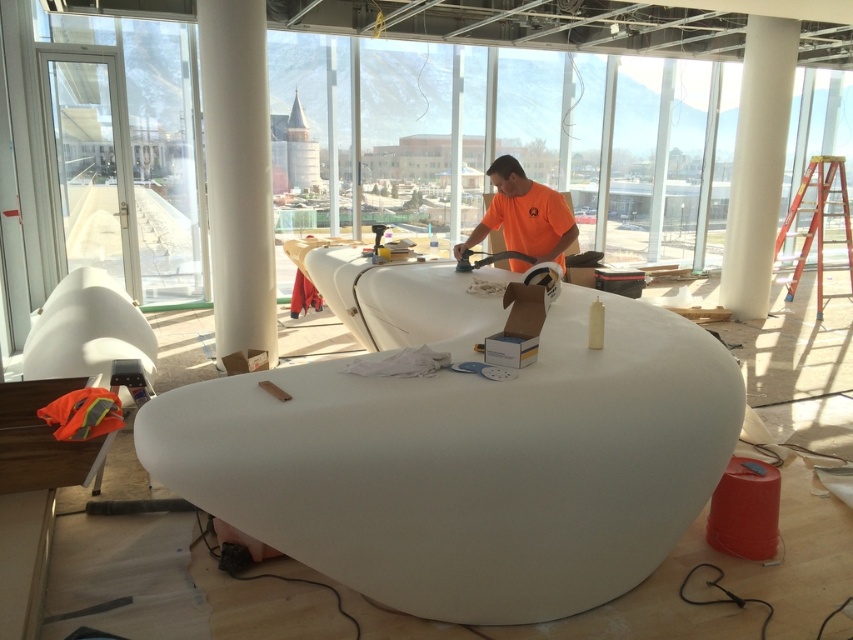
Question: Where is white smooth pillar at center located in relation to orange matte shirt at center in the image?

Choices:
 (A) below
 (B) above

Answer: (B)

Question: From the image, what is the correct spatial relationship of white smooth pillar at center in relation to orange matte shirt at center?

Choices:
 (A) left
 (B) right

Answer: (A)

Question: Is white smooth pillar at center positioned in front of orange matte shirt at center?

Choices:
 (A) no
 (B) yes

Answer: (A)